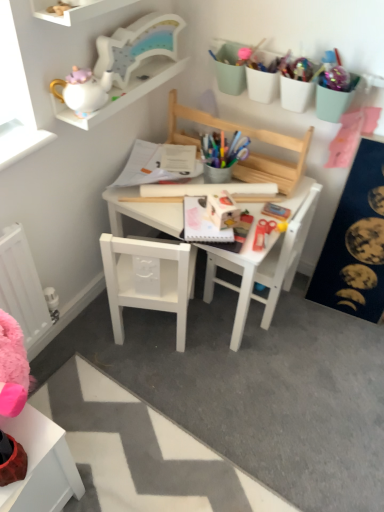
You are a GUI agent. You are given a task and a screenshot of the screen. Output one action in this format:
    pyautogui.click(x=<x>, y=<y>)
    Task: Click on the vacant region below white matte chair at lower left, the 1th chair from the left (from a real-world perspective)
    The width and height of the screenshot is (384, 512).
    Given the screenshot: What is the action you would take?
    pyautogui.click(x=145, y=328)